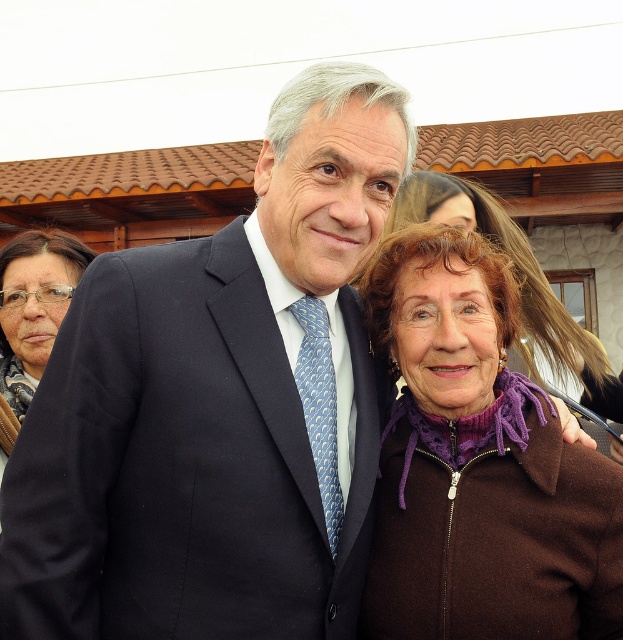
Question: Which object is farther from the camera taking this photo?

Choices:
 (A) purple fleece at right
 (B) blue silk tie at center
 (C) matte black jacket at upper left

Answer: (C)

Question: Observing the image, what is the correct spatial positioning of purple fleece at right in reference to matte black jacket at upper left?

Choices:
 (A) right
 (B) left

Answer: (A)

Question: Among these objects, which one is nearest to the camera?

Choices:
 (A) purple fleece jacket at lower right
 (B) purple fleece at right

Answer: (B)

Question: Can you confirm if purple fleece at right is positioned above purple fleece jacket at lower right?

Choices:
 (A) yes
 (B) no

Answer: (B)

Question: Is the position of purple fleece at right less distant than that of blue silk tie at center?

Choices:
 (A) yes
 (B) no

Answer: (A)

Question: Considering the real-world distances, which object is closest to the matte black jacket at upper left?

Choices:
 (A) purple fleece jacket at lower right
 (B) blue silk tie at center

Answer: (B)